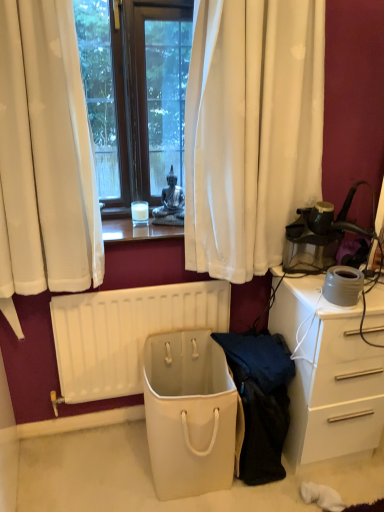
What are the coordinates of `vacant area that is in front of metallic statue at center` in the screenshot? It's located at (162, 231).